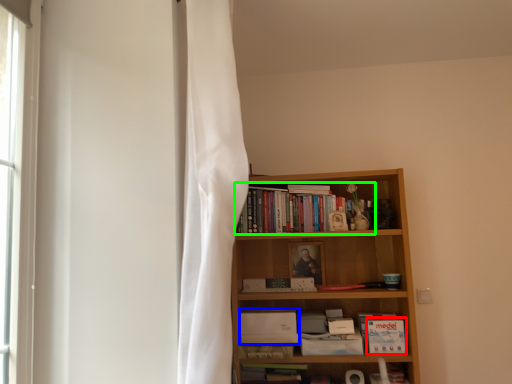
Question: Considering the real-world distances, which object is farthest from paperback book (highlighted by a red box)? paperback book (highlighted by a blue box) or book (highlighted by a green box)?

Choices:
 (A) paperback book
 (B) book

Answer: (B)